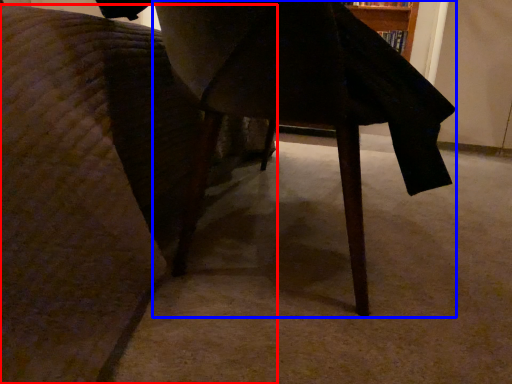
Question: Which of the following is the closest to the observer, furniture (highlighted by a red box) or table (highlighted by a blue box)?

Choices:
 (A) furniture
 (B) table

Answer: (A)